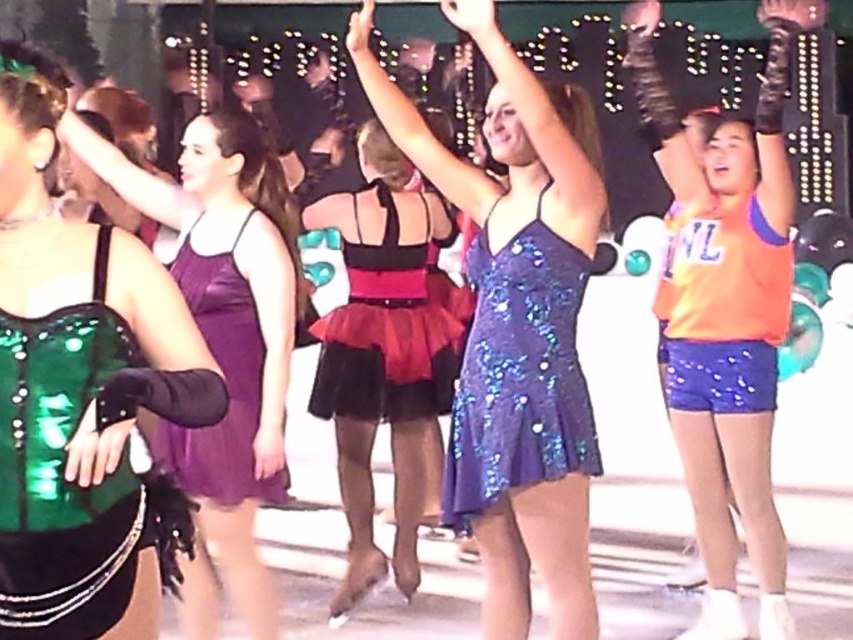
Question: Does shiny blue sequined dress at center appear under purple sequined dress at center?

Choices:
 (A) yes
 (B) no

Answer: (A)

Question: Can you confirm if orange shiny tank top at center is bigger than shiny blue dress at center?

Choices:
 (A) no
 (B) yes

Answer: (B)

Question: Which of these objects is positioned closest to the purple sequined dress at center?

Choices:
 (A) sequined fabric tutu at center
 (B) green shiny corset at left

Answer: (A)

Question: Which point is farther to the camera?

Choices:
 (A) purple sequined dress at center
 (B) sequined fabric tutu at center
 (C) shiny blue sequined dress at center

Answer: (B)

Question: Which object is closer to the camera taking this photo?

Choices:
 (A) sequined fabric tutu at center
 (B) orange shiny tank top at center

Answer: (B)

Question: Does green shiny corset at left come in front of shiny blue sequined dress at center?

Choices:
 (A) no
 (B) yes

Answer: (B)